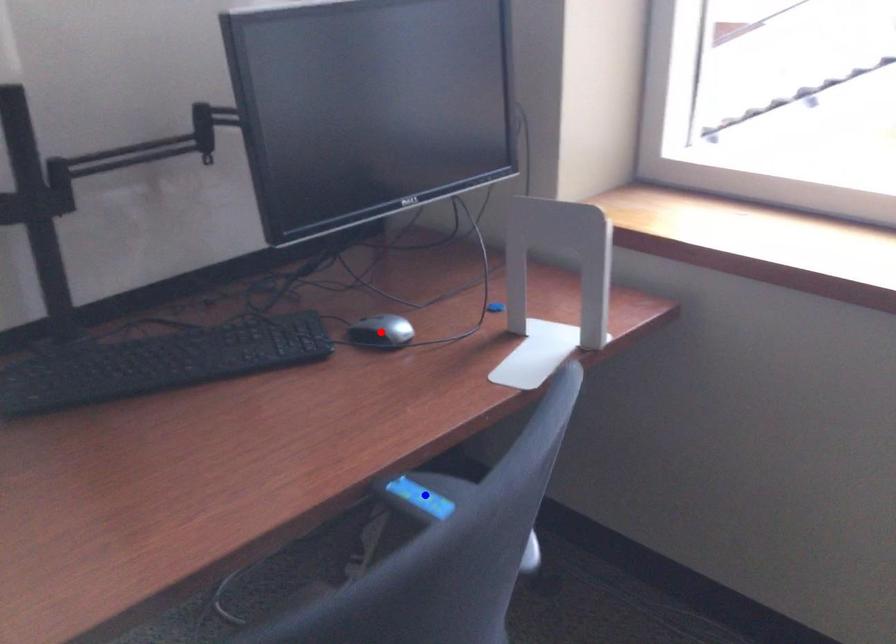
Question: In the image, two points are highlighted. Which point is nearer to the camera? Reply with the corresponding letter.

Choices:
 (A) blue point
 (B) red point

Answer: (A)